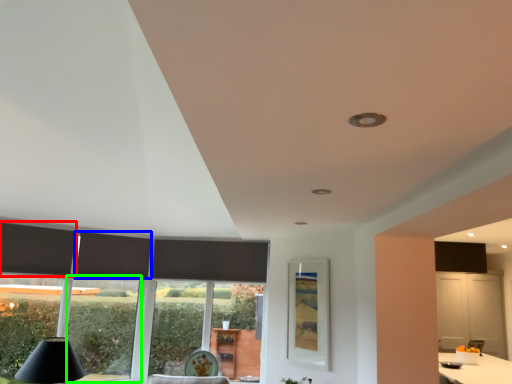
Question: Which object is the farthest from curtain (highlighted by a red box)? Choose among these: curtain (highlighted by a blue box) or window (highlighted by a green box).

Choices:
 (A) curtain
 (B) window

Answer: (B)